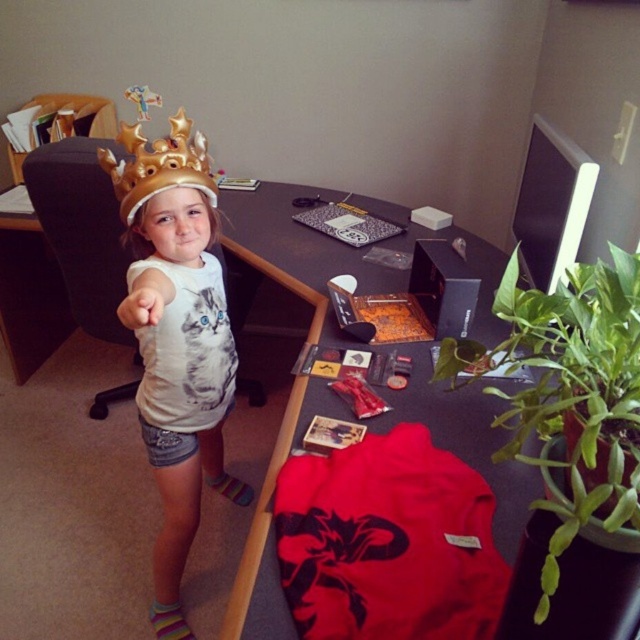
Between point (225, 355) and point (132, 205), which one is positioned behind?

The point (225, 355) is more distant.

Between point (202, 298) and point (168, 140), which one is positioned in front?

Point (168, 140)

Is point (170, 476) positioned after point (134, 147)?

Yes, it is.

Where is `matte gold crown at center`? The image size is (640, 640). matte gold crown at center is located at coordinates (180, 374).